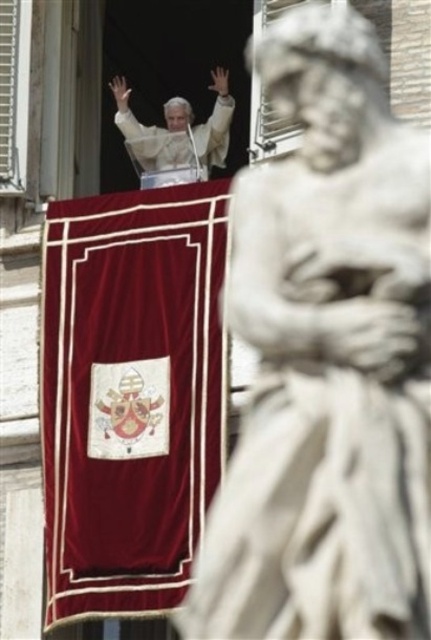
Question: Which of these objects is positioned farthest from the velvet red curtain at center?

Choices:
 (A) white marble statue at upper center
 (B) white marble statue at center

Answer: (A)

Question: Does white marble statue at center appear on the right side of velvet red curtain at center?

Choices:
 (A) yes
 (B) no

Answer: (A)

Question: Can you confirm if velvet red curtain at center is positioned above white marble statue at upper center?

Choices:
 (A) no
 (B) yes

Answer: (A)

Question: Can you confirm if white marble statue at center is positioned below velvet red curtain at center?

Choices:
 (A) yes
 (B) no

Answer: (B)

Question: Which of the following is the closest to the observer?

Choices:
 (A) velvet red curtain at center
 (B) white marble statue at center
 (C) white marble statue at upper center

Answer: (B)

Question: Which object is closer to the camera taking this photo?

Choices:
 (A) white marble statue at upper center
 (B) velvet red curtain at center
 (C) white marble statue at center

Answer: (C)